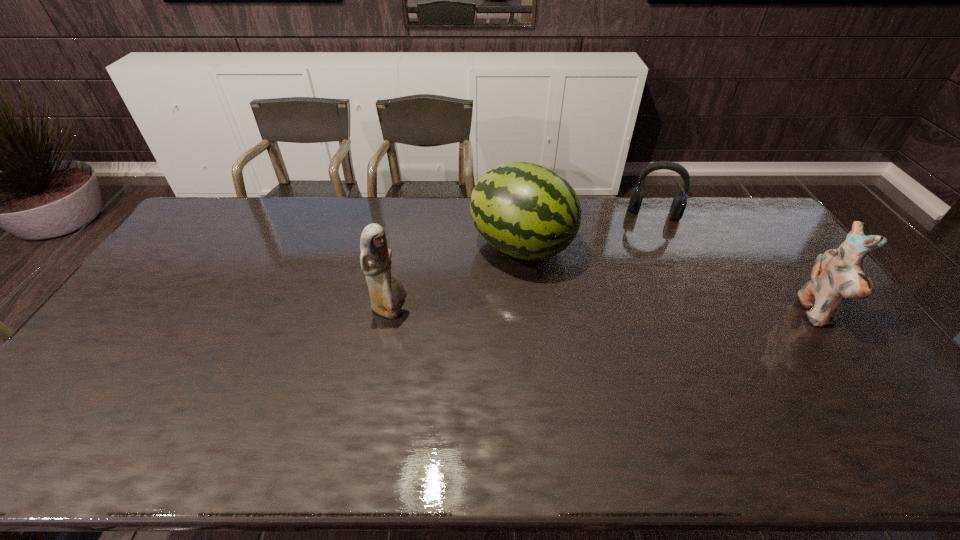
This screenshot has width=960, height=540. Find the location of `vacant space located at the stem end of the watermelon`. vacant space located at the stem end of the watermelon is located at coordinates tap(591, 278).

The height and width of the screenshot is (540, 960). I want to click on vacant space located 0.320m at the stem end of the watermelon, so (663, 310).

At what (x,y) coordinates should I click in order to perform the action: click on headset present at the far edge. Please return your answer as a coordinate pair (x, y). The height and width of the screenshot is (540, 960). Looking at the image, I should click on (679, 203).

Where is `watermelon present at the far edge`? watermelon present at the far edge is located at coordinates (529, 212).

Find the location of a particular element. The width and height of the screenshot is (960, 540). object that is at the right edge is located at coordinates (837, 274).

This screenshot has height=540, width=960. In order to click on blank space at the far edge of the desktop in this screenshot , I will do `click(246, 227)`.

This screenshot has width=960, height=540. Find the location of `vacant position at the near edge of the desktop`. vacant position at the near edge of the desktop is located at coordinates (170, 393).

This screenshot has width=960, height=540. I want to click on vacant area at the left edge, so click(182, 268).

At what (x,y) coordinates should I click in order to perform the action: click on free space at the right edge. Please return your answer as a coordinate pair (x, y). The height and width of the screenshot is (540, 960). Looking at the image, I should click on (804, 343).

Identify the location of free space between the second object from left to right and the leftmost object. This screenshot has width=960, height=540. (456, 279).